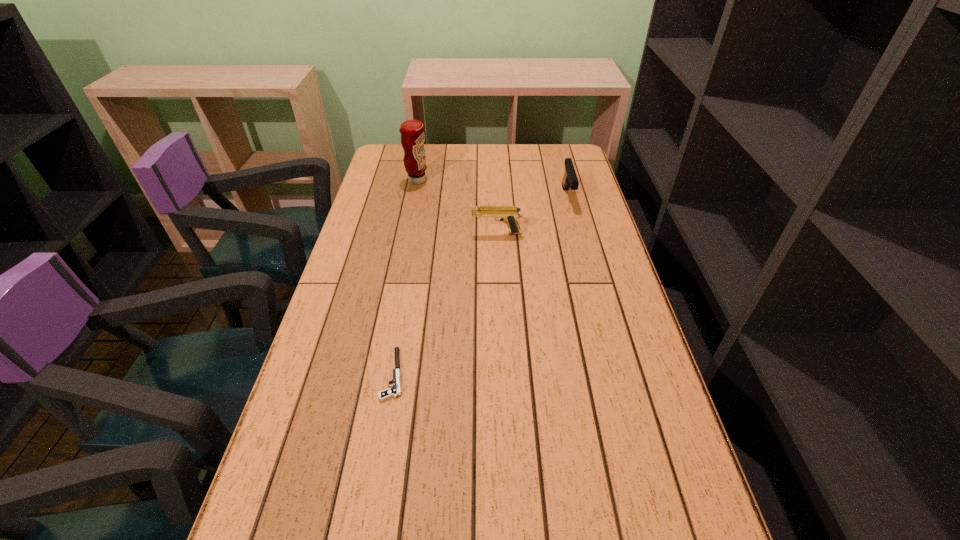
Find the location of a particular element. The image size is (960, 540). free spot that satisfies the following two spatial constraints: 1. on the front-facing side of the rightmost object; 2. at the barrel of the second pistol from right to left is located at coordinates [577, 233].